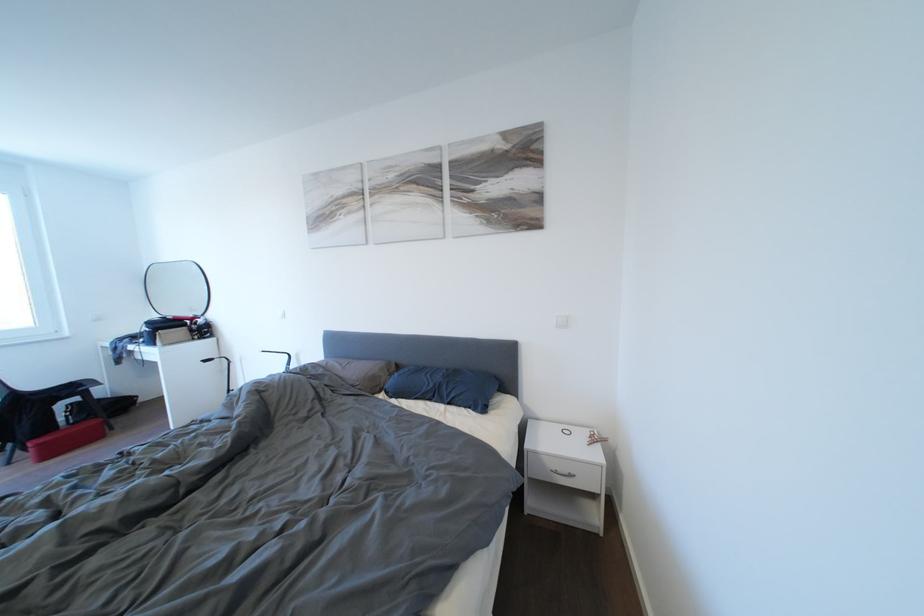
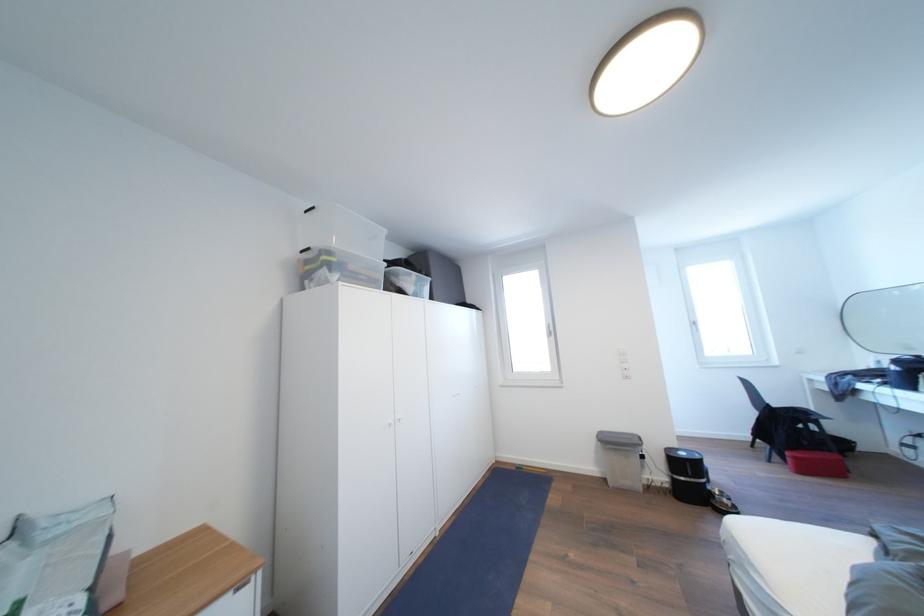
Locate, in the second image, the point that corresponds to pixel 46 450 in the first image.

(803, 463)